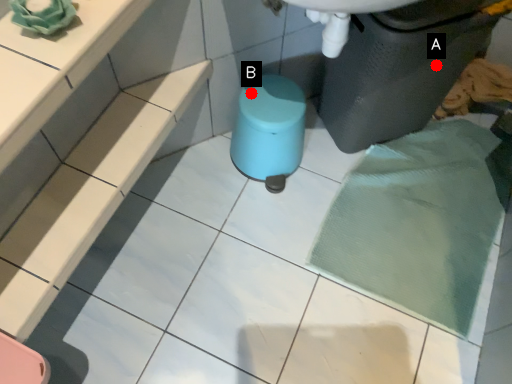
Question: Two points are circled on the image, labeled by A and B beside each circle. Which point appears farthest from the camera in this image?

Choices:
 (A) A is further
 (B) B is further

Answer: (B)